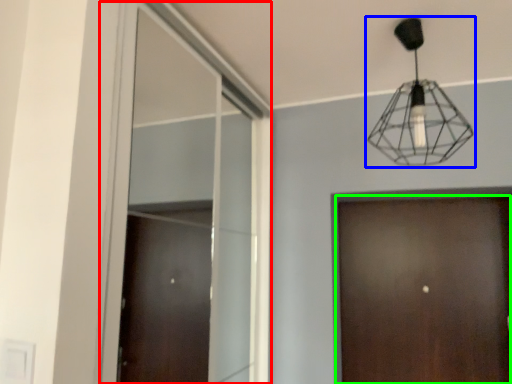
Question: Considering the real-world distances, which object is closest to window (highlighted by a red box)? lamp (highlighted by a blue box) or door (highlighted by a green box).

Choices:
 (A) lamp
 (B) door

Answer: (B)